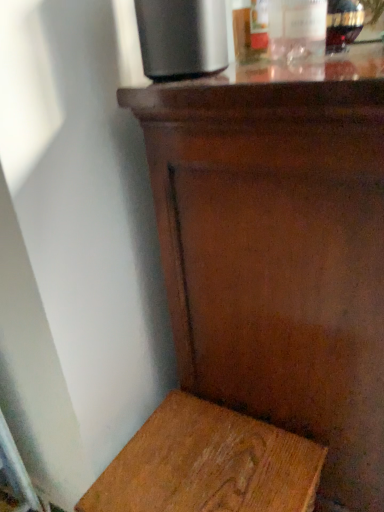
Question: Considering their positions, is wooden stool at lower left located in front of or behind shiny brown wood table at center?

Choices:
 (A) behind
 (B) front

Answer: (A)

Question: Is wooden stool at lower left to the left or to the right of shiny brown wood table at center in the image?

Choices:
 (A) right
 (B) left

Answer: (B)

Question: Estimate the real-world distances between objects in this image. Which object is closer to the translucent glass bottle at upper right, the 1th bottle when ordered from right to left?

Choices:
 (A) clear glass bottle at upper right, marked as the first bottle in a left-to-right arrangement
 (B) satin black speaker at upper center
 (C) wooden stool at lower left
 (D) shiny brown wood table at center

Answer: (A)

Question: Estimate the real-world distances between objects in this image. Which object is farther from the shiny brown wood table at center?

Choices:
 (A) clear glass bottle at upper right, marked as the 2th bottle in a right-to-left arrangement
 (B) satin black speaker at upper center
 (C) translucent glass bottle at upper right, the 1th bottle when ordered from right to left
 (D) wooden stool at lower left

Answer: (C)